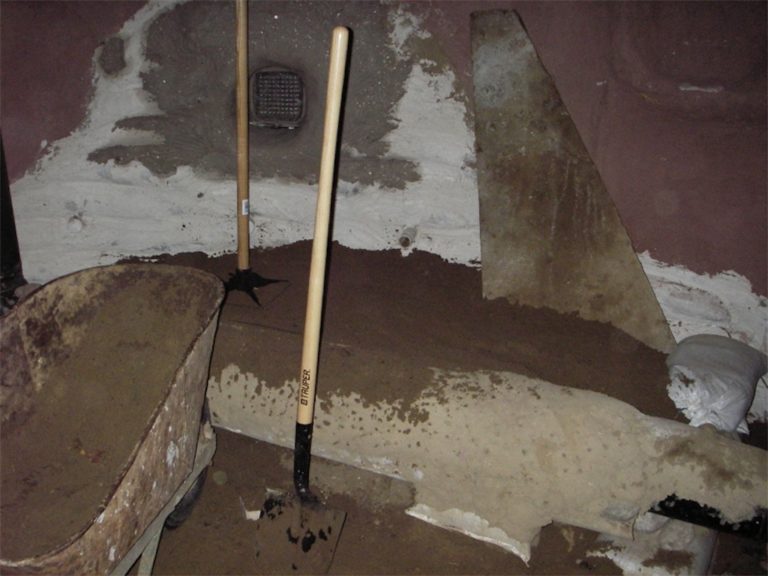
Image resolution: width=768 pixels, height=576 pixels. What are the coordinates of `wood handle` in the screenshot? It's located at (313, 293), (243, 150).